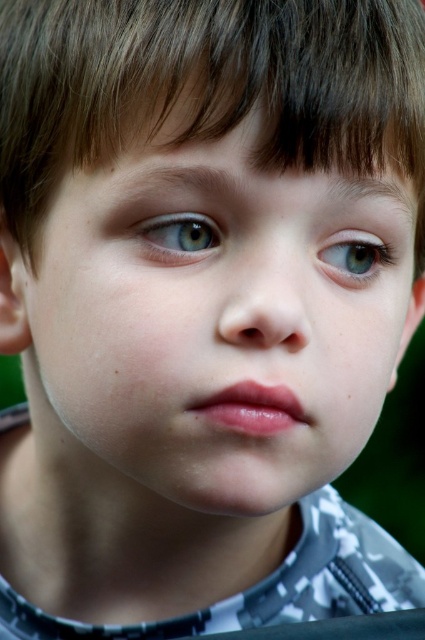
You are a photographer adjusting the focus on a camera. The subject has a light blue eye at center. You need to ensure both eyes are in focus. How far apart are the eyes?

The light blue eye at center and the other eye are 14.71 inches apart.

You are a photographer adjusting your camera settings to focus on two specific points in the image. The points are labeled as point 1 at coordinates point (x=337, y=278) and point 2 at coordinates point (x=206, y=230). Since you want to ensure the subject is in sharp focus, which point should you prioritize focusing on, the one closer to the camera or the one further away?

You should prioritize focusing on point (x=337, y=278) because it is further to the camera than point (x=206, y=230), making it the closer point to the lens and thus more critical for sharpness.